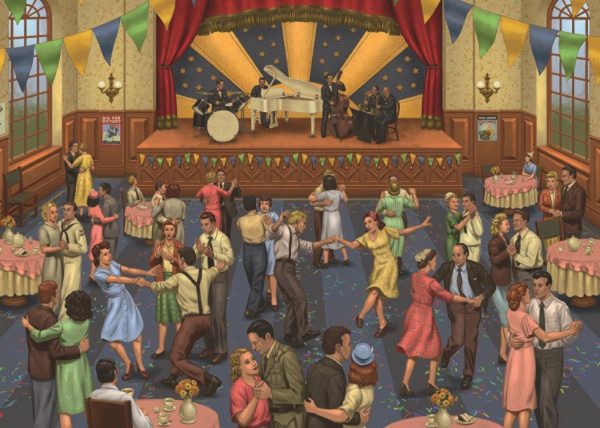
This screenshot has width=600, height=428. I want to click on wooden trim, so click(44, 180), click(101, 152), click(477, 142), click(552, 167), click(595, 185).